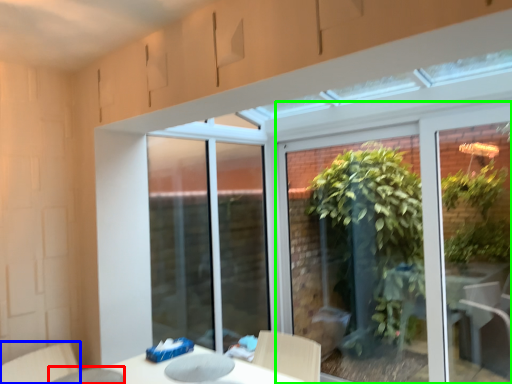
Question: Estimate the real-world distances between objects in this image. Which object is closer to glass table (highlighted by a red box), swivel chair (highlighted by a blue box) or window (highlighted by a green box)?

Choices:
 (A) swivel chair
 (B) window

Answer: (A)